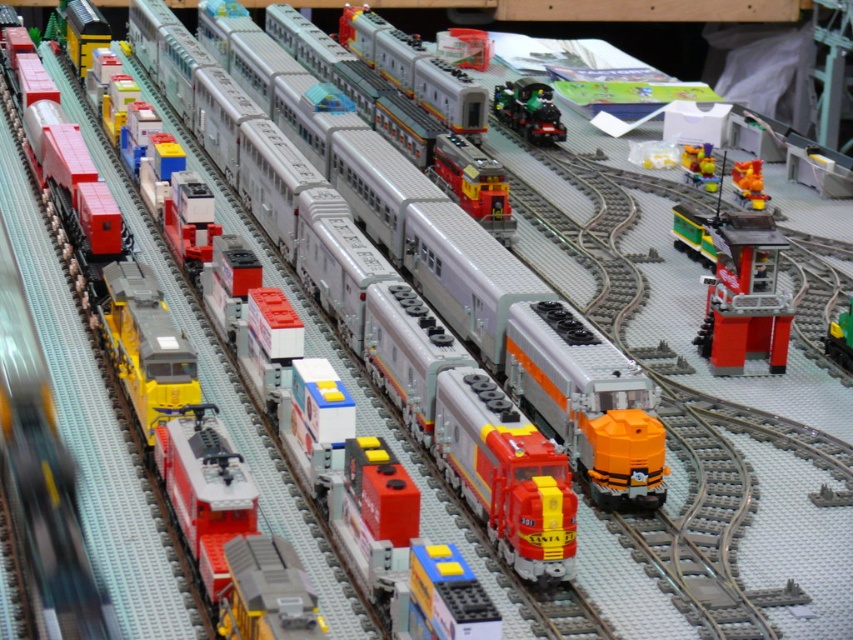
Based on the photo, you are navigating a model train set and need to locate the matte plastic train at center. According to the coordinates provided, where exactly is the matte plastic train positioned?

The matte plastic train at center is located at point coordinates of (521, 333).

In the scene shown: You are a model train enthusiast who wants to place a 12 inch long toy car between the brick red plastic train station at right and the shiny red train at center. Is there enough space to place the toy car without it overlapping either object?

The brick red plastic train station at right and shiny red train at center are 31.89 inches apart. Since the toy car is 12 inches long, there is sufficient space between them to place it without overlapping either object.